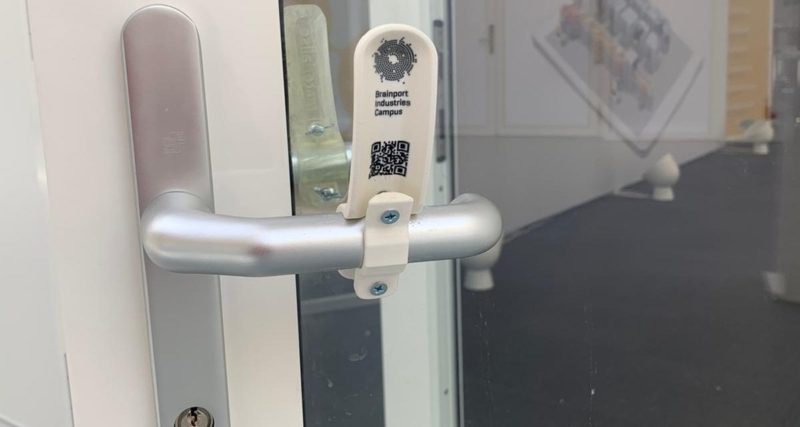
This screenshot has width=800, height=427. Identify the location of window. (586, 344).